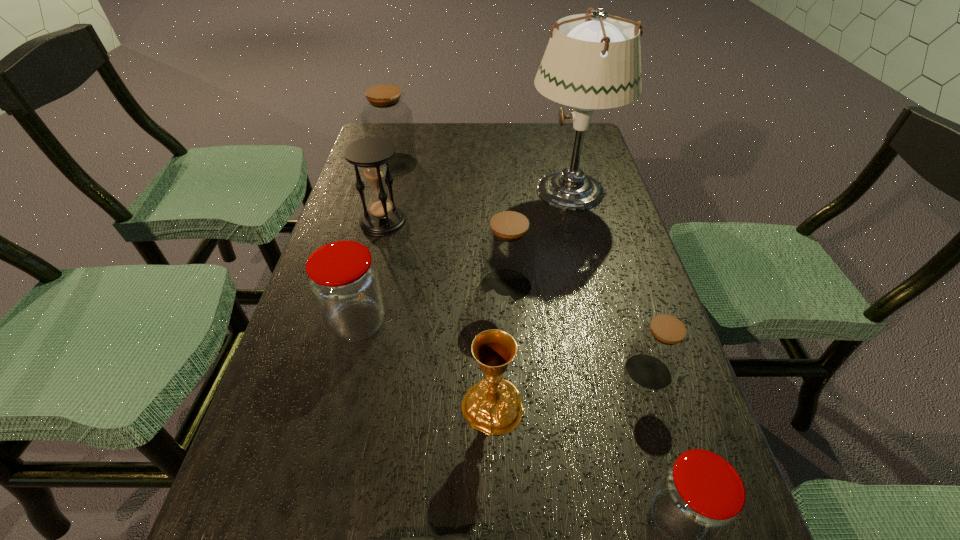
You are a GUI agent. You are given a task and a screenshot of the screen. Output one action in this format:
    pyautogui.click(x=<x>, y=<y>)
    Task: Click on the vacant region between the chalice and the hourglass
    The image size is (960, 540).
    Given the screenshot: What is the action you would take?
    click(438, 314)

Where is `free space that is in between the gold chalice and the left red jar`? free space that is in between the gold chalice and the left red jar is located at coordinates (425, 364).

Point out which object is positioned as the eighth nearest to the tallest object. Please provide its 2D coordinates. Your answer should be formatted as a tuple, i.e. [(x, y)], where the tuple contains the x and y coordinates of a point satisfying the conditions above.

[(459, 539)]

At what (x,y) coordinates should I click in order to perform the action: click on object identified as the third closest to the leftmost brown jar. Please return your answer as a coordinate pair (x, y). The height and width of the screenshot is (540, 960). Looking at the image, I should click on (507, 249).

Image resolution: width=960 pixels, height=540 pixels. In order to click on the fourth closest jar to the second nearest brown jar in this screenshot , I will do `click(385, 115)`.

Find the location of a particular element. jar identified as the second closest to the tallest object is located at coordinates (385, 115).

Image resolution: width=960 pixels, height=540 pixels. In order to click on brown jar that is the closest one to the smallest brown jar in this screenshot , I will do [507, 249].

The image size is (960, 540). Identify the location of brown jar that is the third closest to the chalice. (385, 115).

Image resolution: width=960 pixels, height=540 pixels. I want to click on free space that satisfies the following two spatial constraints: 1. on the lampshade of the smallest brown jar; 2. on the left side of the tallest object, so click(x=616, y=373).

Find the location of a particular element. free spot that satisfies the following two spatial constraints: 1. on the front side of the biggest brown jar; 2. on the left side of the hourglass is located at coordinates (379, 221).